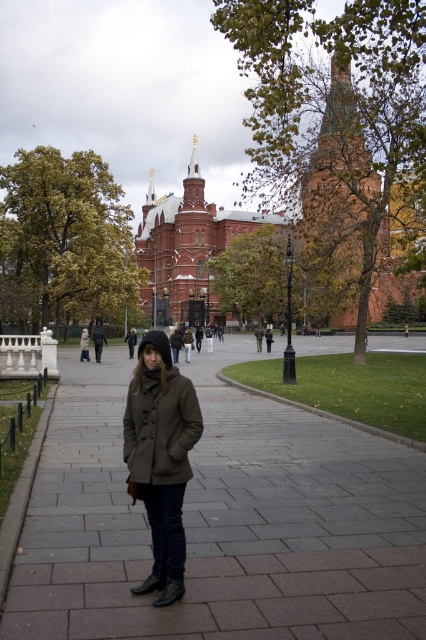
In the scene shown: You are a fashion designer observing two coats in the scene. Which coat is placed lower in the image, the olive green wool coat at center or the brown woolen coat at center?

The olive green wool coat at center is positioned under the brown woolen coat at center, so it is placed lower in the image.

You are a photographer trying to capture both the olive green wool coat at center and the brown woolen coat at center in a single frame. Since you want to ensure both coats are visible, which direction should you move your camera to include both?

The olive green wool coat at center is to the right of the brown woolen coat at center. To include both in the frame, you should move your camera to the left to capture the brown woolen coat at center and then pan right to include the olive green wool coat at center, or adjust your angle to encompass both.

You are standing in a public square in a European city. You see a person in a dark green coat standing on the smooth concrete pavement at center. If you want to walk to the person, which direction should you head towards?

You should head towards the center of the square where the smooth concrete pavement at center is located, as the person is standing there.